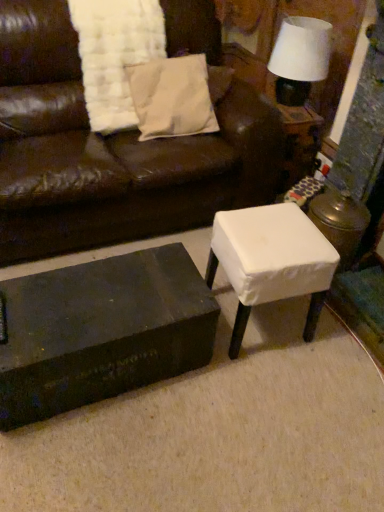
Question: Is white fabric lampshade at upper right surrounding white fabric-covered stool at right?

Choices:
 (A) yes
 (B) no

Answer: (B)

Question: From the image's perspective, is white fabric lampshade at upper right beneath white fabric-covered stool at right?

Choices:
 (A) no
 (B) yes

Answer: (A)

Question: Does white fabric lampshade at upper right have a smaller size compared to white fabric-covered stool at right?

Choices:
 (A) no
 (B) yes

Answer: (B)

Question: Does white fabric lampshade at upper right come behind white fabric-covered stool at right?

Choices:
 (A) no
 (B) yes

Answer: (A)

Question: Are white fabric lampshade at upper right and white fabric-covered stool at right far apart?

Choices:
 (A) yes
 (B) no

Answer: (B)

Question: Based on their positions, is black matte/wooden coffee table at lower left located to the left or right of white fabric-covered stool at right?

Choices:
 (A) right
 (B) left

Answer: (B)

Question: Considering their positions, is black matte/wooden coffee table at lower left located in front of or behind white fabric-covered stool at right?

Choices:
 (A) behind
 (B) front

Answer: (B)

Question: Considering the positions of point (127, 278) and point (296, 117), is point (127, 278) closer or farther from the camera than point (296, 117)?

Choices:
 (A) farther
 (B) closer

Answer: (B)

Question: Is black matte/wooden coffee table at lower left taller or shorter than white fabric-covered stool at right?

Choices:
 (A) short
 (B) tall

Answer: (A)

Question: Would you say white cotton pillow at upper center is to the left or to the right of matte brown leather couch at center in the picture?

Choices:
 (A) right
 (B) left

Answer: (A)

Question: In terms of width, does white cotton pillow at upper center look wider or thinner when compared to matte brown leather couch at center?

Choices:
 (A) wide
 (B) thin

Answer: (B)

Question: From the image's perspective, is white cotton pillow at upper center located above or below matte brown leather couch at center?

Choices:
 (A) above
 (B) below

Answer: (A)

Question: Is point (198, 72) positioned closer to the camera than point (29, 183)?

Choices:
 (A) farther
 (B) closer

Answer: (A)

Question: Is matte brown leather couch at center wider or thinner than white cotton pillow at upper center?

Choices:
 (A) wide
 (B) thin

Answer: (A)

Question: Looking at the image, does matte brown leather couch at center seem bigger or smaller compared to white cotton pillow at upper center?

Choices:
 (A) small
 (B) big

Answer: (B)